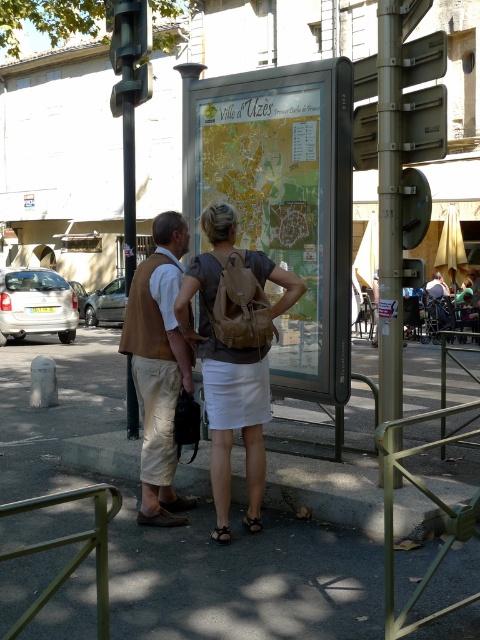
Consider the image. You are a tourist trying to read the metallic silver sign at upper right but the gold metallic pole at right is blocking your view. Can you move around the pole to see the sign?

The metallic silver sign at upper right is behind the gold metallic pole at right, so moving around the pole might allow you to see the sign if there is a clear path.

You are a tourist trying to find the nearest restroom. You see the gold metallic pole at right and the metallic silver sign at upper right. Which object should you look at to find the restroom location?

The gold metallic pole at right is bigger than the metallic silver sign at upper right, so you should look at the gold metallic pole at right for the restroom location.

You are a tourist trying to locate the nearest restroom. You see the brown backpack at center and the metallic silver sign at upper right. According to the map on the tourist information board, which object is closer to the restroom location?

The brown backpack at center is positioned on the left side of metallic silver sign at upper right. Since the restroom is typically indicated on maps near points of interest, the metallic silver sign at upper right might be closer to the restroom location based on its position relative to the backpack.